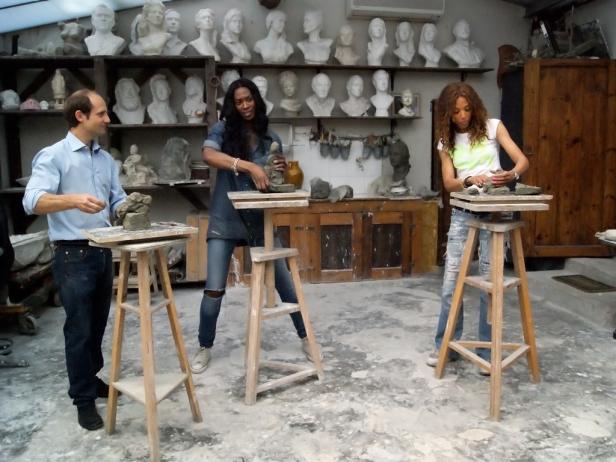
Locate an element on the screen. Image resolution: width=616 pixels, height=462 pixels. small statue is located at coordinates (73, 34).